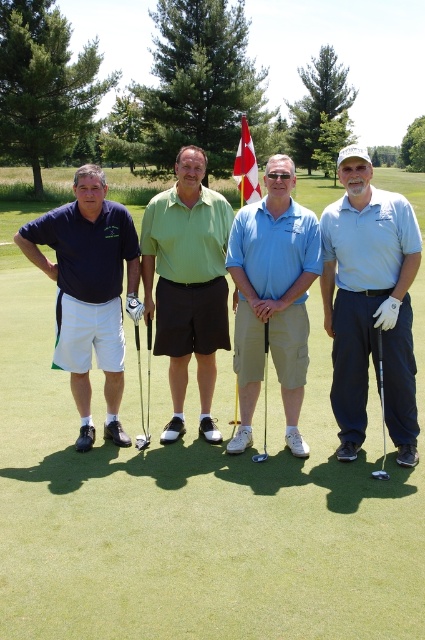
You are a photographer standing at the edge of the golf course. You want to take a photo of the metallic silver golf club at center. Where should you position yourself to capture it in the frame?

To capture the metallic silver golf club at center in the frame, position yourself at the edge of the golf course facing towards the center where the golf club is located at coordinates approximately 0.603 on the x axis and 0.332 on the y axis.